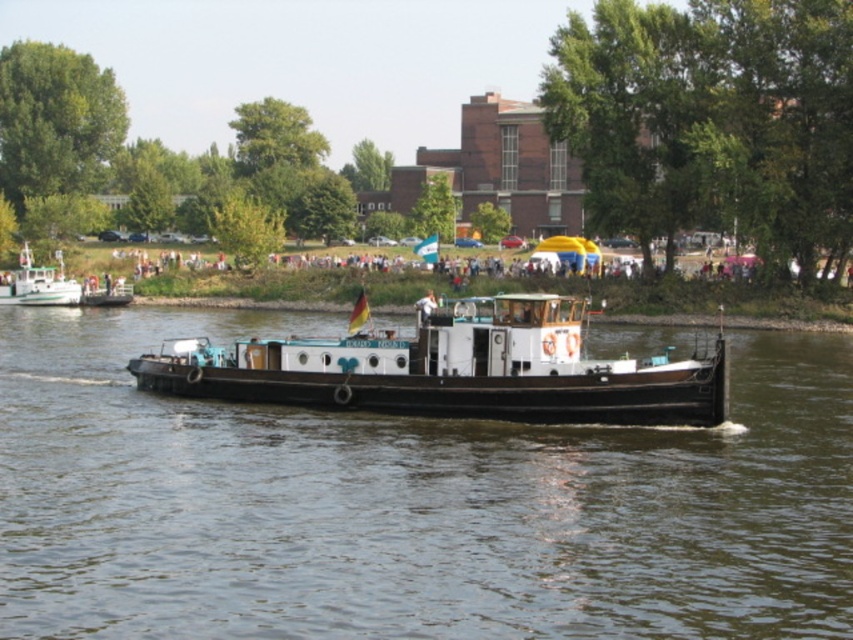
What are the coordinates of `black matte barge at center` in the screenshot? It's located at (409, 502).

Which is more to the right, black matte barge at center or green matte boat at left?

Positioned to the right is black matte barge at center.

Which is behind, point (285, 605) or point (74, 301)?

The point (74, 301) is more distant.

Find the location of a particular element. black matte barge at center is located at coordinates (409, 502).

This screenshot has height=640, width=853. Describe the element at coordinates (454, 371) in the screenshot. I see `wooden boat at center` at that location.

Is point (712, 426) less distant than point (26, 301)?

Yes, point (712, 426) is in front of point (26, 301).

What do you see at coordinates (454, 371) in the screenshot? This screenshot has height=640, width=853. I see `wooden boat at center` at bounding box center [454, 371].

The image size is (853, 640). I want to click on wooden boat at center, so click(454, 371).

Is black matte barge at center thinner than wooden boat at center?

No, black matte barge at center is not thinner than wooden boat at center.

Who is positioned more to the right, black matte barge at center or wooden boat at center?

wooden boat at center is more to the right.

This screenshot has height=640, width=853. Describe the element at coordinates (409, 502) in the screenshot. I see `black matte barge at center` at that location.

Find the location of a particular element. The height and width of the screenshot is (640, 853). black matte barge at center is located at coordinates pyautogui.click(x=409, y=502).